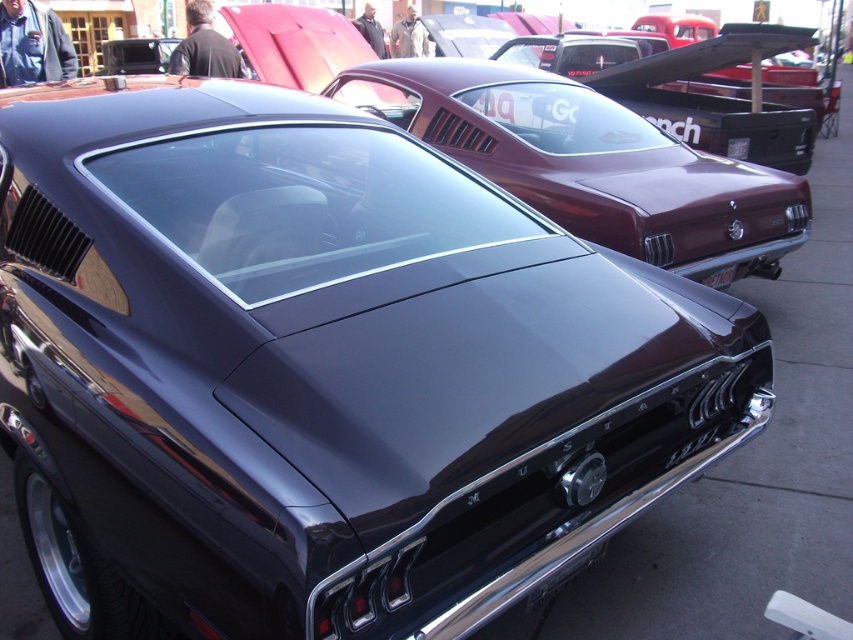
You are a photographer at the car show and want to capture both the black plastic license plate at center and the black plastic license plate at rear in a single shot. Which license plate will appear smaller in the photo?

The black plastic license plate at center will appear smaller in the photo because it has a smaller size compared to the black plastic license plate at rear.